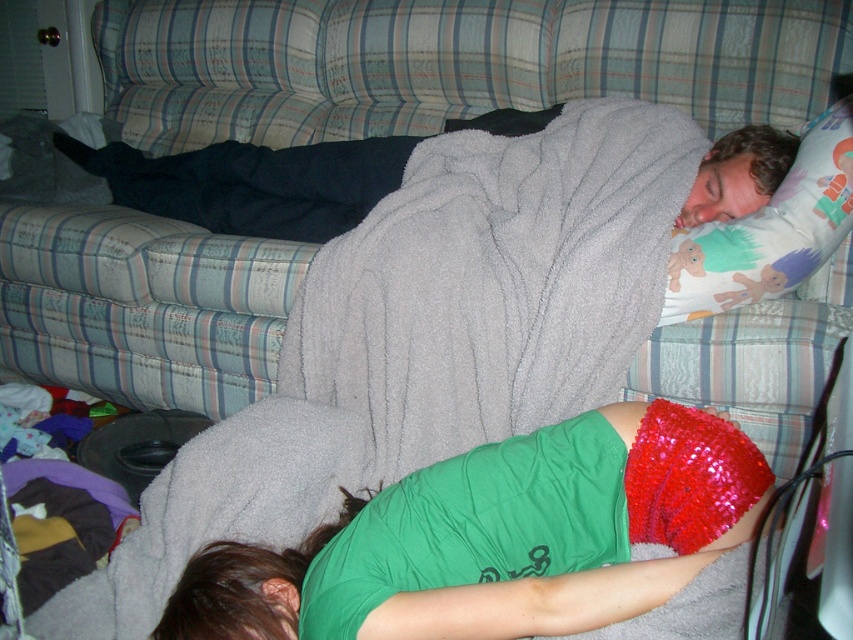
Question: Does green fabric shorts at lower center have a smaller size compared to white fabric pillow at upper right?

Choices:
 (A) yes
 (B) no

Answer: (B)

Question: Which point appears farthest from the camera in this image?

Choices:
 (A) (764, 291)
 (B) (540, 531)

Answer: (A)

Question: Does green fabric shorts at lower center appear on the right side of white fabric pillow at upper right?

Choices:
 (A) yes
 (B) no

Answer: (B)

Question: Which point is closer to the camera?

Choices:
 (A) white fabric pillow at upper right
 (B) green fabric shorts at lower center

Answer: (B)

Question: Does green fabric shorts at lower center appear on the right side of white fabric pillow at upper right?

Choices:
 (A) no
 (B) yes

Answer: (A)